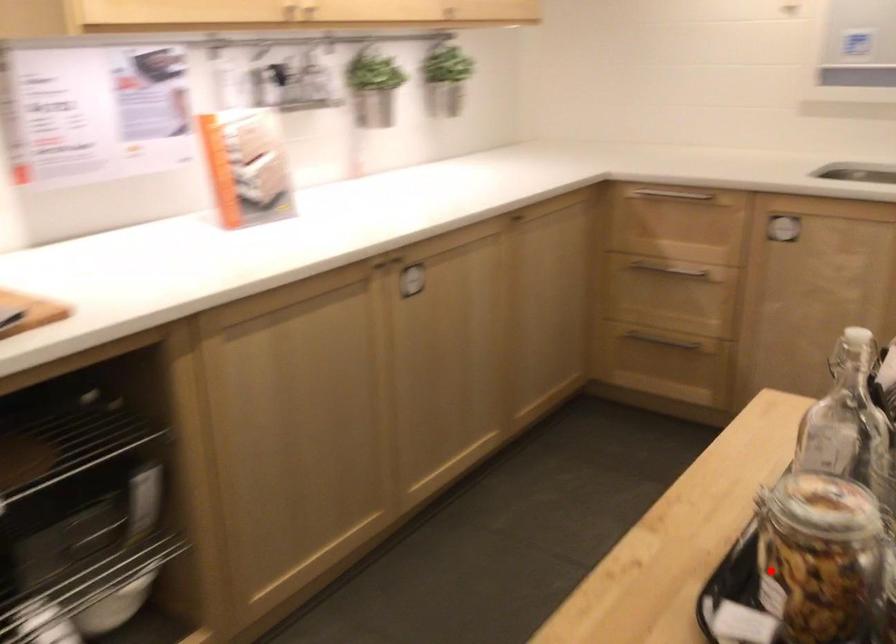
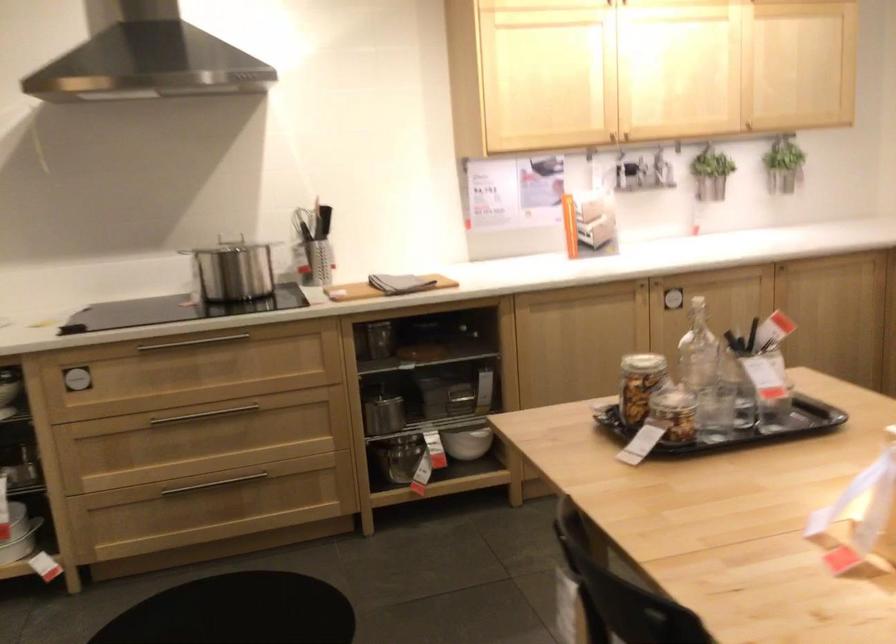
The point at the highlighted location is marked in the first image. Where is the corresponding point in the second image?

(640, 384)